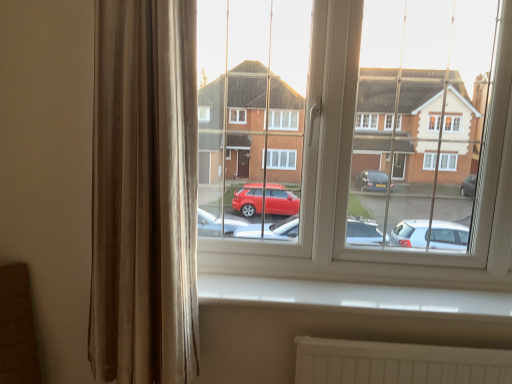
Question: Considering the relative positions of transparent glass window at center and velvet beige curtain at left in the image provided, is transparent glass window at center to the left or to the right of velvet beige curtain at left?

Choices:
 (A) right
 (B) left

Answer: (A)

Question: Do you think transparent glass window at center is within velvet beige curtain at left, or outside of it?

Choices:
 (A) inside
 (B) outside

Answer: (B)

Question: Which is farther from the transparent glass window at center?

Choices:
 (A) velvet beige curtain at left
 (B) white plastic window sill at lower center

Answer: (A)

Question: Which object is positioned closest to the velvet beige curtain at left?

Choices:
 (A) white plastic window sill at lower center
 (B) transparent glass window at center

Answer: (A)